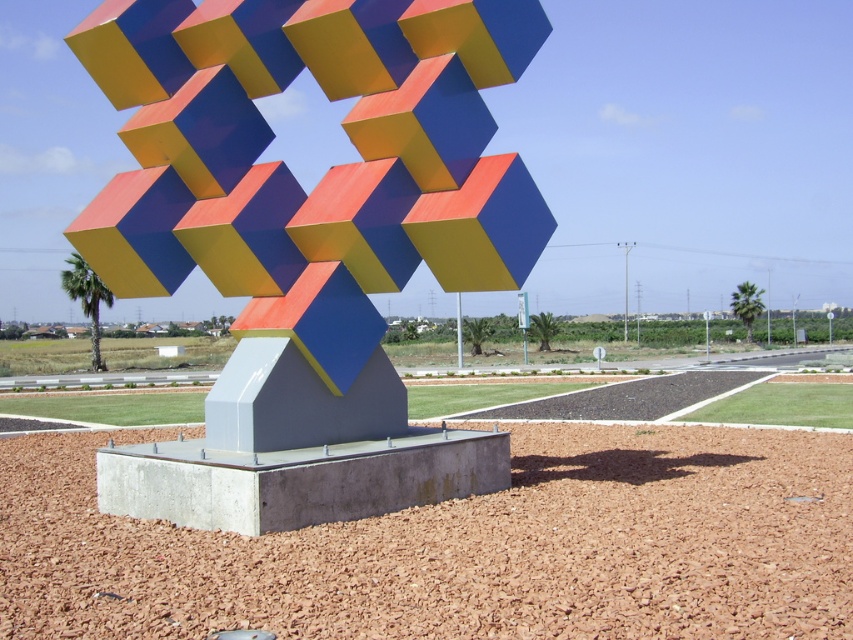
Question: Which of the following is the closest to the observer?

Choices:
 (A) smooth concrete base at center
 (B) matte painted cube at center

Answer: (A)

Question: Is matte painted cube at center above smooth concrete base at center?

Choices:
 (A) yes
 (B) no

Answer: (A)

Question: Which point is closer to the camera taking this photo?

Choices:
 (A) (263, 88)
 (B) (393, 621)

Answer: (B)

Question: Is matte painted cube at center to the right of smooth concrete base at center from the viewer's perspective?

Choices:
 (A) no
 (B) yes

Answer: (B)

Question: Which of the following is the farthest from the observer?

Choices:
 (A) (671, 547)
 (B) (350, 323)

Answer: (B)

Question: Can you confirm if matte painted cube at center is positioned to the left of smooth concrete base at center?

Choices:
 (A) no
 (B) yes

Answer: (A)